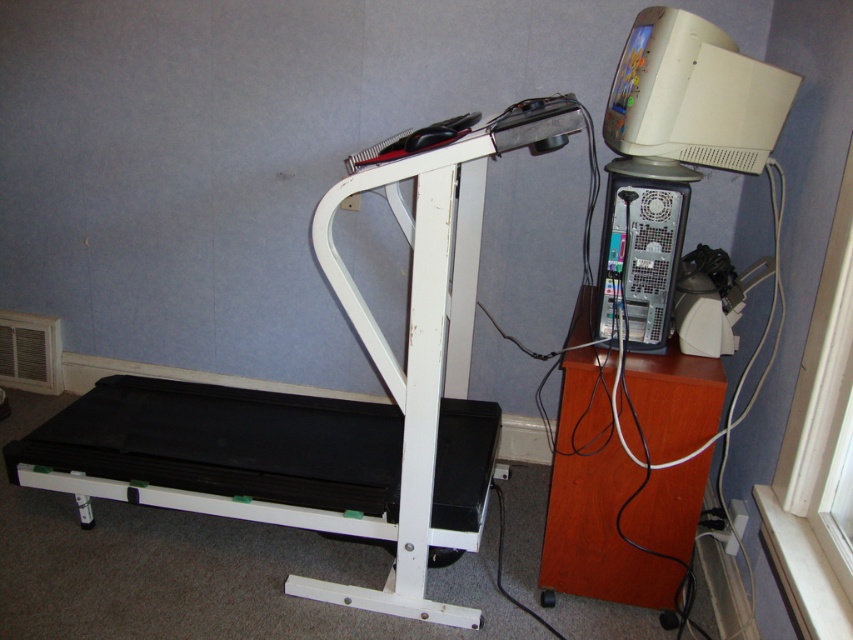
Measure the distance from beige plastic monitor at upper right to white plastic air conditioner at lower left.

beige plastic monitor at upper right and white plastic air conditioner at lower left are 2.42 meters apart from each other.

Which is behind, point (619, 99) or point (4, 352)?

The point (4, 352) is more distant.

What are the coordinates of `beige plastic monitor at upper right` in the screenshot? It's located at (694, 96).

Identify the location of beige plastic monitor at upper right. Image resolution: width=853 pixels, height=640 pixels. (694, 96).

Does black rubber treadmill at left have a smaller size compared to beige plastic monitor at upper right?

Incorrect, black rubber treadmill at left is not smaller in size than beige plastic monitor at upper right.

How much distance is there between black rubber treadmill at left and beige plastic monitor at upper right?

black rubber treadmill at left is 20.74 inches away from beige plastic monitor at upper right.

Where is `black rubber treadmill at left`? The width and height of the screenshot is (853, 640). black rubber treadmill at left is located at coordinates (322, 408).

I want to click on black rubber treadmill at left, so click(322, 408).

Which of these two, black rubber treadmill at left or white plastic air conditioner at lower left, stands taller?

Standing taller between the two is black rubber treadmill at left.

Does black rubber treadmill at left appear on the right side of white plastic air conditioner at lower left?

Yes, black rubber treadmill at left is to the right of white plastic air conditioner at lower left.

Does point (260, 436) lie in front of point (50, 349)?

Yes, point (260, 436) is in front of point (50, 349).

In order to click on black rubber treadmill at left in this screenshot , I will do `click(322, 408)`.